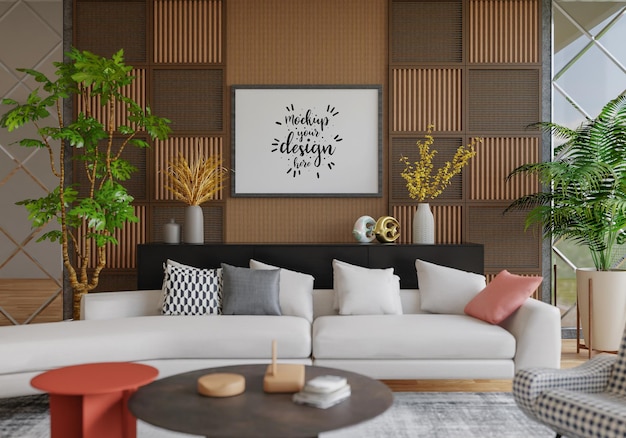
The height and width of the screenshot is (438, 626). In order to click on white vase in this screenshot , I will do `click(422, 227)`.